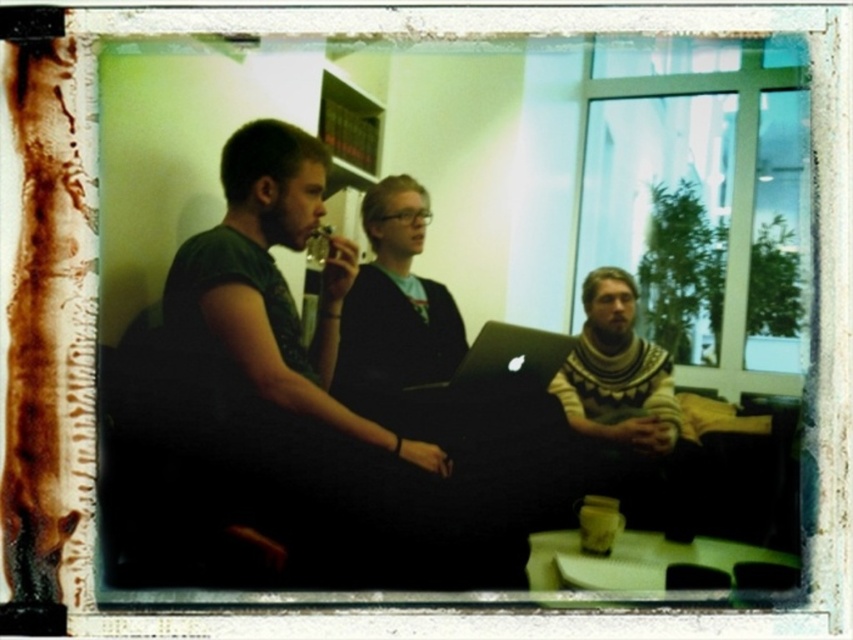
Does knitted sweater at center have a greater height compared to black matte laptop at center?

Yes, knitted sweater at center is taller than black matte laptop at center.

Can you confirm if knitted sweater at center is positioned below black matte laptop at center?

Correct, knitted sweater at center is located below black matte laptop at center.

Does point (643, 422) lie behind point (482, 336)?

No, it is not.

In order to click on knitted sweater at center in this screenshot , I will do `click(618, 372)`.

How far apart are matte black sweater at center and knitted sweater at center?

matte black sweater at center is 28.29 centimeters from knitted sweater at center.

Who is more forward, (440, 298) or (688, 465)?

Positioned in front is point (688, 465).

You are a GUI agent. You are given a task and a screenshot of the screen. Output one action in this format:
    pyautogui.click(x=<x>, y=<y>)
    Task: Click on the matte black sweater at center
    This screenshot has height=640, width=853.
    Given the screenshot: What is the action you would take?
    (395, 307)

Does green matte shirt at center have a greater width compared to knitted sweater at center?

Indeed, green matte shirt at center has a greater width compared to knitted sweater at center.

Is green matte shirt at center thinner than knitted sweater at center?

No, green matte shirt at center is not thinner than knitted sweater at center.

At what (x,y) coordinates should I click in order to perform the action: click on green matte shirt at center. Please return your answer as a coordinate pair (x, y). This screenshot has width=853, height=640. Looking at the image, I should click on (281, 323).